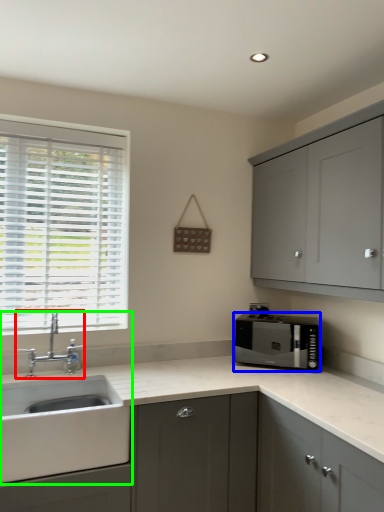
Question: Which object is the closest to the tap (highlighted by a red box)? Choose among these: microwave oven (highlighted by a blue box) or sink (highlighted by a green box).

Choices:
 (A) microwave oven
 (B) sink

Answer: (B)